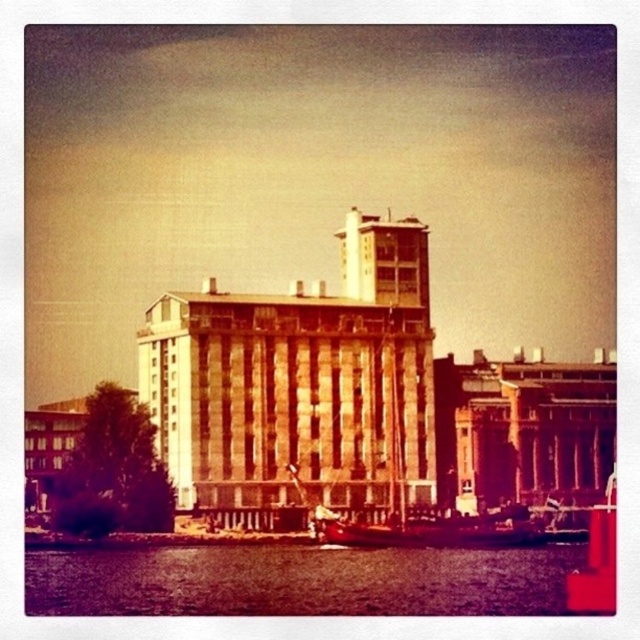
You are standing at the waterfront and want to determine the relative positions of two points marked in the scene. Which point is closer to you, point 1 at coordinates point 1 at coordinates point (132, 592) or point (422, 540)?

Point (132, 592) is closer to the viewer than point (422, 540).

You are standing on the waterfront and see the purple water at lower left and the smooth wooden boat at center. Which object is nearer to you?

The purple water at lower left is closer to the viewer than the smooth wooden boat at center.

You are standing on the dock and see the purple water at lower left and the smooth wooden boat at center. Which object is closer to the dock?

The smooth wooden boat at center is closer to the dock since it is positioned above the purple water at lower left, which is underneath it.